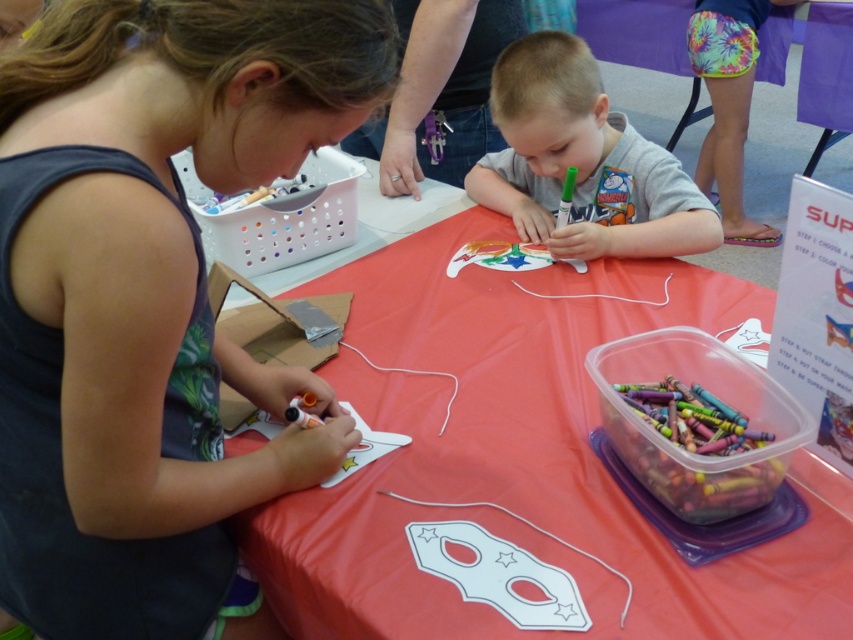
You are a child trying to reach the matte white paper mask at center and the gray matte shirt at center. Which object is closer to you?

The matte white paper mask at center is closer to you because it is in front of the gray matte shirt at center.

You are a parent trying to organize the craft area. You need to place the matte white paper mask at center and the gray matte shirt at center closer together. How much space do you need to reduce between them?

The matte white paper mask at center and gray matte shirt at center are currently 9.47 inches apart. To place them closer together, you need to reduce the space between them by 9.47 inches minus the desired distance. However, without knowing the target distance, the exact reduction cannot be calculated. But currently, the space between them is 9.47 inches.